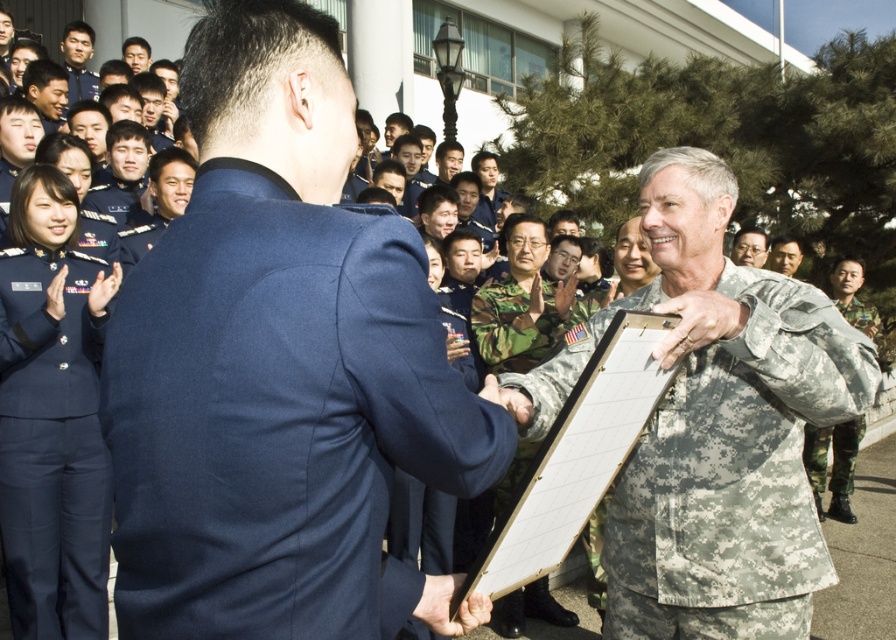
Question: Is blue woolen suit at center below blue uniform at upper left?

Choices:
 (A) no
 (B) yes

Answer: (B)

Question: Does blue woolen suit at center have a greater width compared to matte gray uniform at center?

Choices:
 (A) no
 (B) yes

Answer: (B)

Question: Is blue woolen suit at center above camouflage fabric uniform at center?

Choices:
 (A) no
 (B) yes

Answer: (B)

Question: Which of the following is the closest to the observer?

Choices:
 (A) (843, 435)
 (B) (649, 595)
 (C) (767, 252)

Answer: (B)

Question: Which of the following is the farthest from the observer?

Choices:
 (A) (820, 438)
 (B) (695, 358)

Answer: (A)

Question: Considering the real-world distances, which object is closest to the camouflage fabric clipboard at center?

Choices:
 (A) matte gray uniform at center
 (B) navy blue fabric uniform at left
 (C) blue woolen suit at center

Answer: (C)